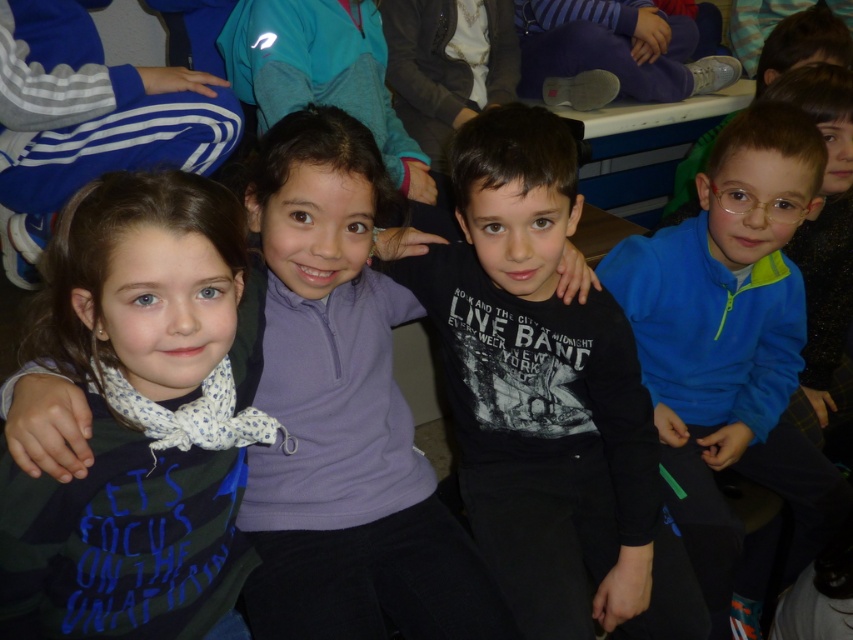
You are standing in the classroom and want to find the camouflage fabric shirt at left. According to the coordinates provided, where should you look?

You should look at point (122, 540) to find the camouflage fabric shirt at left.